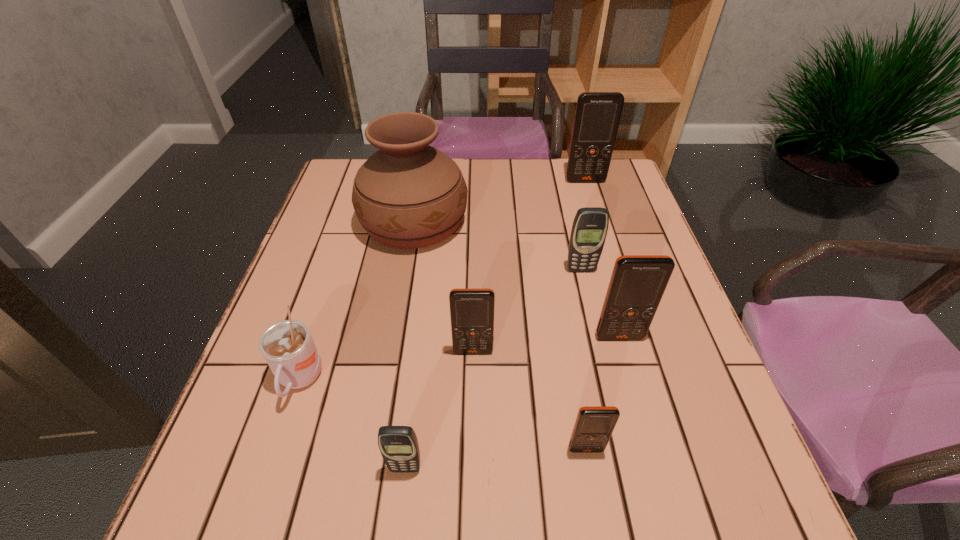
At what (x,y) coordinates should I click in order to perform the action: click on the third orange cellular telephone from right to left. Please return your answer as a coordinate pair (x, y). This screenshot has height=540, width=960. Looking at the image, I should click on (594, 425).

Identify the location of the second nearest object. The width and height of the screenshot is (960, 540). (594, 425).

In order to click on the leftmost cellular telephone in this screenshot , I will do `click(399, 447)`.

At what (x,y) coordinates should I click in order to perform the action: click on the nearer gray cellular telephone. Please return your answer as a coordinate pair (x, y). Looking at the image, I should click on click(399, 447).

Identify the location of vacant space located 0.290m on the right of the urn. This screenshot has width=960, height=540. (575, 222).

Image resolution: width=960 pixels, height=540 pixels. I want to click on free spot located on the screen of the farthest orange cellular telephone, so click(600, 230).

Image resolution: width=960 pixels, height=540 pixels. Find the location of `free space located 0.090m on the screen of the fourth nearest cellular telephone`. free space located 0.090m on the screen of the fourth nearest cellular telephone is located at coordinates (632, 380).

Locate an element on the screen. free space located on the screen of the sixth nearest object is located at coordinates (597, 341).

The height and width of the screenshot is (540, 960). Identify the location of free space located on the screen of the fifth cellular telephone from right to left. (471, 491).

Locate an element on the screen. Image resolution: width=960 pixels, height=540 pixels. free region located 0.190m on the side with the handle of the cup is located at coordinates (251, 528).